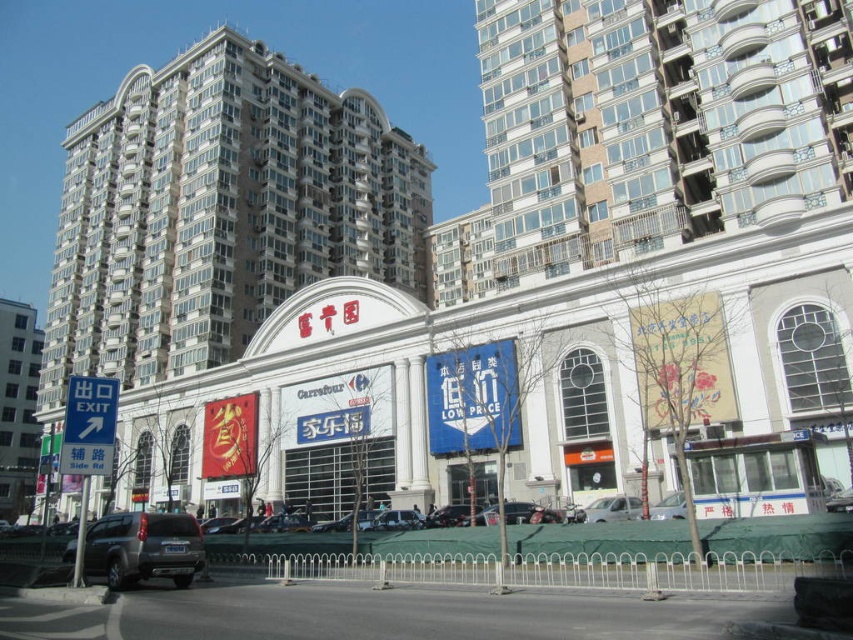
You are a delivery driver needing to park your vehicle, which is the same width as the dark gray matte suv at lower left. There is a parking spot next to the white glossy building at center. Can your vehicle fit sideways into that space without touching the building?

The white glossy building at center might be wider than the dark gray matte suv at lower left, so there is uncertainty if the parking space next to it is wide enough. You should check the actual width before attempting to park.

You are standing at the entrance of the white glossy building at center. If you walk straight ahead, will you face the red sign with Chinese characters or the blue banner?

The white glossy building at center has the red sign with Chinese characters above its main entrance. Since you are standing at the entrance facing forward, you would face the red sign with Chinese characters directly ahead.

You are standing at the entrance of the white glossy building at center. If you walk straight ahead, will you face the red sign with Chinese characters or the blue banner?

The white glossy building at center has a red sign with Chinese characters above its main entrance and a blue banner nearby. Since you are facing the entrance, walking straight ahead would keep the red sign and blue banner in your forward view, but the question specifies facing one or the other. However, based on the scene description, the red sign is above the entrance, so directly in front, while the blue banner is adjacent. The answer depends on exact positioning. Since the objects description doesn not.